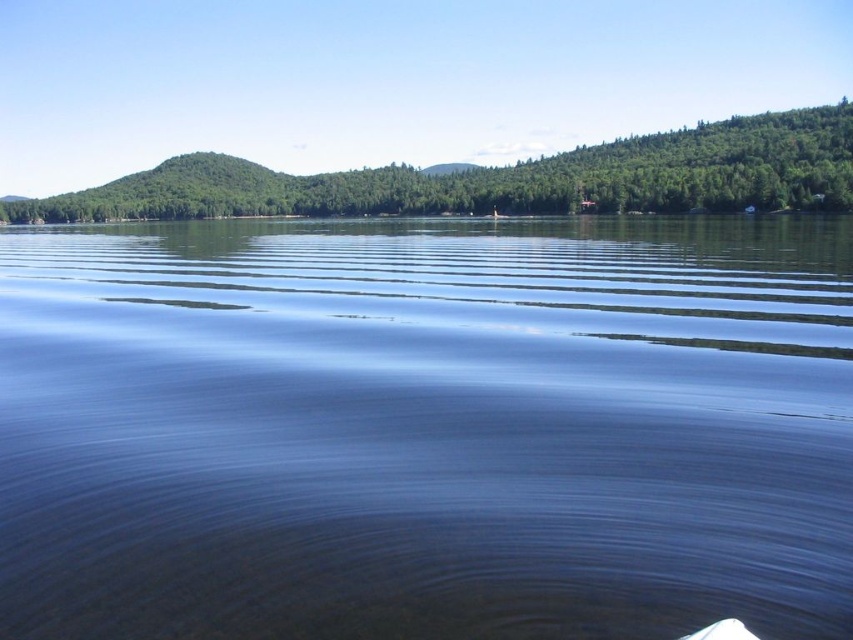
From the picture: Which is above, transparent water at center or green matte tree at upper center?

green matte tree at upper center is higher up.

The image size is (853, 640). What do you see at coordinates (426, 428) in the screenshot?
I see `transparent water at center` at bounding box center [426, 428].

Identify the location of transparent water at center. (426, 428).